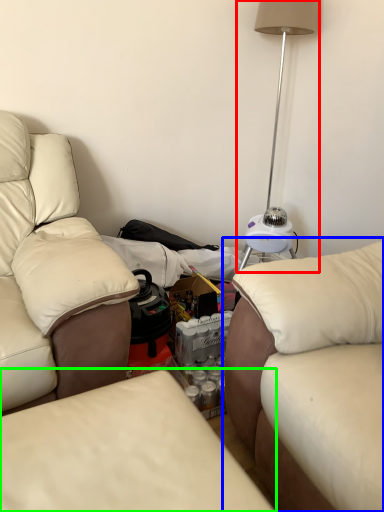
Question: Which is farther away from table lamp (highlighted by a red box)? studio couch (highlighted by a blue box) or studio couch (highlighted by a green box)?

Choices:
 (A) studio couch
 (B) studio couch

Answer: (B)